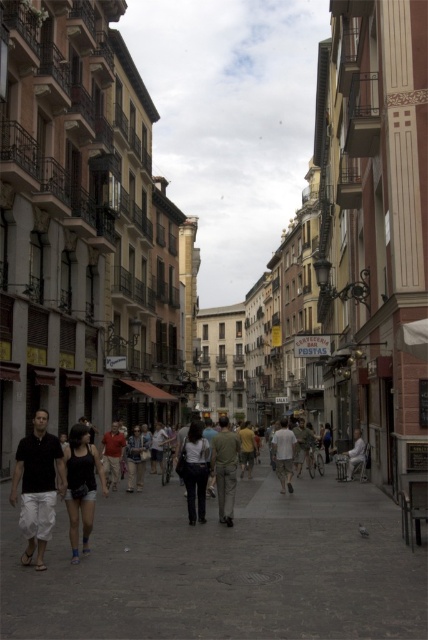
You are standing on the gray concrete pavement at center. What is your 2D coordinate location?

The gray concrete pavement at center is located at the 2D coordinate point of (223, 566).